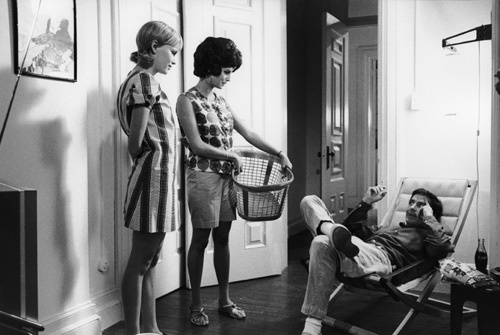
What are the coordinates of `laundry` in the screenshot? It's located at (261, 200).